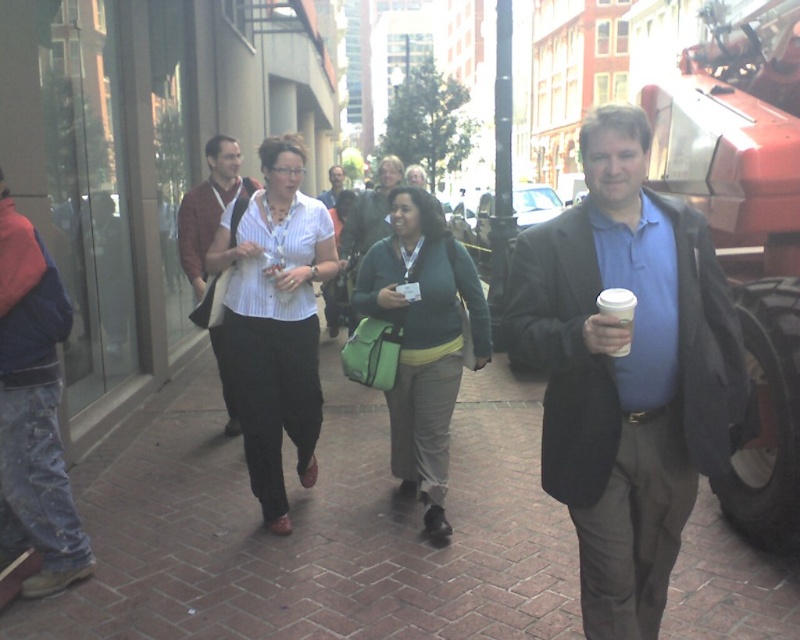
You are standing in the middle of the brick street and want to walk towards the nearest point between point A at point (20, 364) and point B at point (629, 324). Which point should you head towards to reach the closest one first?

Point A at point (20, 364) is closer to you than point B at point (629, 324) because it is further to the viewer. Therefore, you should head towards point A at point (20, 364) first.

You are a photographer standing on the sidewalk and want to take a photo of the denim jacket at left and the white paper cup at right. Which object should you focus on first if you want to capture both in the same frame without moving the camera?

The denim jacket at left is taller than the white paper cup at right, so you should focus on the denim jacket at left first to ensure it fits within the frame before adjusting for the smaller object.

You are a photographer standing on the sidewalk. You want to take a photo of both the white striped shirt at center and the matte brown jacket at center. Which one should you focus on first to ensure both are in sharp focus?

You should focus on the white striped shirt at center first because it is closer to the viewer than the matte brown jacket at center, so adjusting focus from near to far will help both be in focus.